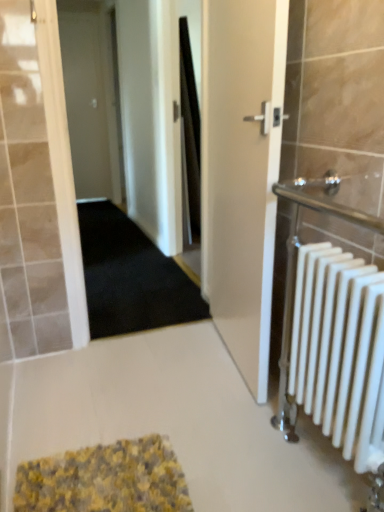
Question: Is the depth of white glossy door at center, which ranks as the 2th door in left-to-right order, greater than that of white matte door at upper left, the 1th door when ordered from left to right?

Choices:
 (A) yes
 (B) no

Answer: (B)

Question: Is white glossy door at center, the first door in the bottom-to-top sequence, wider than white matte door at upper left, arranged as the 1th door when viewed from the top?

Choices:
 (A) no
 (B) yes

Answer: (B)

Question: Is white glossy door at center, which ranks as the 2th door in left-to-right order, smaller than white matte door at upper left, marked as the second door in a front-to-back arrangement?

Choices:
 (A) no
 (B) yes

Answer: (A)

Question: Is white glossy door at center, which is counted as the 1th door, starting from the right, at the right side of white matte door at upper left, the 2th door positioned from the right?

Choices:
 (A) no
 (B) yes

Answer: (B)

Question: From the image's perspective, does white glossy door at center, arranged as the first door when viewed from the front, appear higher than white matte door at upper left, the 1th door when ordered from left to right?

Choices:
 (A) no
 (B) yes

Answer: (A)

Question: Considering their positions, is white matte radiator at right located in front of or behind white matte door at upper left, the 1th door from the back?

Choices:
 (A) behind
 (B) front

Answer: (B)

Question: Is point (345, 415) positioned closer to the camera than point (99, 137)?

Choices:
 (A) farther
 (B) closer

Answer: (B)

Question: From the image's perspective, is white matte radiator at right above or below white matte door at upper left, the 1th door from the back?

Choices:
 (A) above
 (B) below

Answer: (B)

Question: In terms of height, does white matte radiator at right look taller or shorter compared to white matte door at upper left, the 1th door when ordered from left to right?

Choices:
 (A) tall
 (B) short

Answer: (B)

Question: Is white glossy door at center, which is counted as the 1th door, starting from the right, inside the boundaries of yellow textured bath mat at lower center, or outside?

Choices:
 (A) outside
 (B) inside

Answer: (A)

Question: Considering the positions of white glossy door at center, which ranks as the 2th door in left-to-right order, and yellow textured bath mat at lower center in the image, is white glossy door at center, which ranks as the 2th door in left-to-right order, bigger or smaller than yellow textured bath mat at lower center?

Choices:
 (A) small
 (B) big

Answer: (B)

Question: In the image, is white glossy door at center, the first door in the bottom-to-top sequence, on the left side or the right side of yellow textured bath mat at lower center?

Choices:
 (A) right
 (B) left

Answer: (A)

Question: Is white glossy door at center, arranged as the first door when viewed from the front, in front of or behind yellow textured bath mat at lower center in the image?

Choices:
 (A) front
 (B) behind

Answer: (B)

Question: Considering the positions of white matte radiator at right and black carpet at center in the image, is white matte radiator at right taller or shorter than black carpet at center?

Choices:
 (A) short
 (B) tall

Answer: (B)

Question: Looking at their shapes, would you say white matte radiator at right is wider or thinner than black carpet at center?

Choices:
 (A) wide
 (B) thin

Answer: (B)